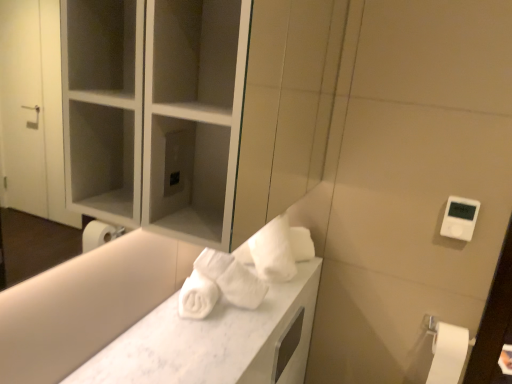
Question: In terms of height, does white matte toilet paper at lower right look taller or shorter compared to white marble counter top at center?

Choices:
 (A) tall
 (B) short

Answer: (A)

Question: From a real-world perspective, is white matte toilet paper at lower right above or below white marble counter top at center?

Choices:
 (A) below
 (B) above

Answer: (A)

Question: Considering their positions, is white matte toilet paper at lower right located in front of or behind white marble counter top at center?

Choices:
 (A) behind
 (B) front

Answer: (A)

Question: Would you say white marble counter top at center is to the left or to the right of white matte toilet paper at lower right in the picture?

Choices:
 (A) left
 (B) right

Answer: (A)

Question: Considering the positions of white marble counter top at center and white matte toilet paper at lower right in the image, is white marble counter top at center taller or shorter than white matte toilet paper at lower right?

Choices:
 (A) tall
 (B) short

Answer: (B)

Question: Does point (273, 286) appear closer or farther from the camera than point (445, 354)?

Choices:
 (A) closer
 (B) farther

Answer: (A)

Question: Is white marble counter top at center inside or outside of white matte toilet paper at lower right?

Choices:
 (A) outside
 (B) inside

Answer: (A)